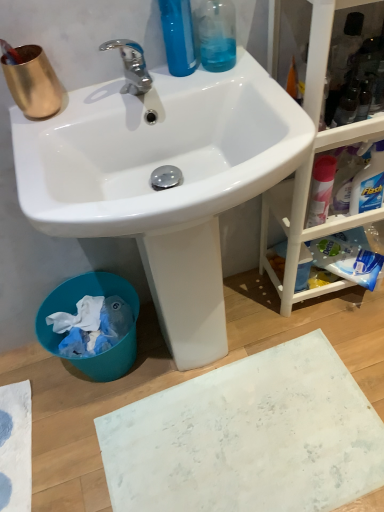
This screenshot has width=384, height=512. Find the location of `blank space situated above white matte bath mat at lower center (from a real-world perspective)`. blank space situated above white matte bath mat at lower center (from a real-world perspective) is located at coordinates (245, 441).